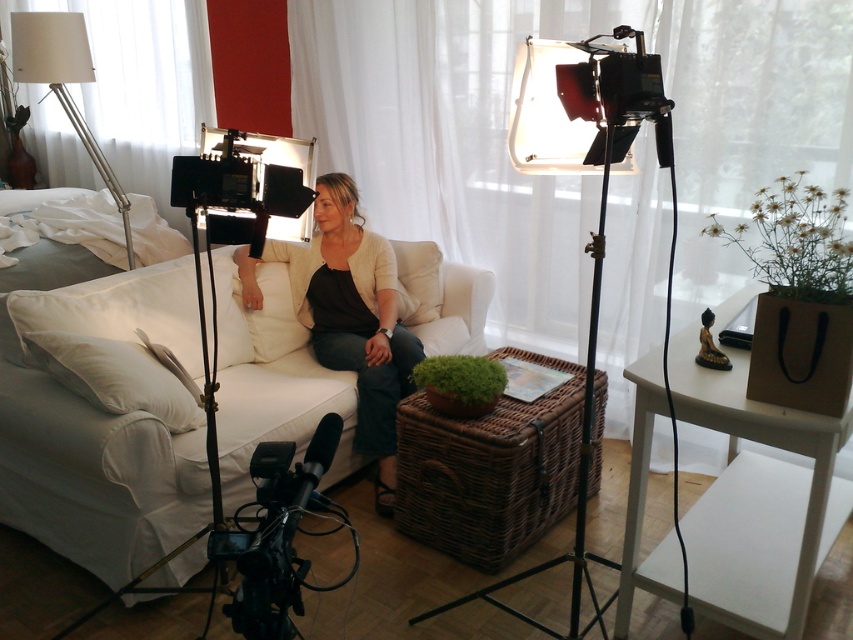
Looking at the scene, where is the white sheer curtain at upper center positioned relative to the white fabric couch at center?

The white sheer curtain at upper center is positioned to the right of the white fabric couch at center.

You are an interior designer planning to replace the white sheer curtain at upper center and the white fabric lampshade at upper left with new ones. If you want to maintain the current width proportions between them, which object should you choose to be wider when purchasing new items?

The white sheer curtain at upper center should be wider than the white fabric lampshade at upper left when purchasing new items to maintain the current width proportions between them.

You are a photographer setting up for a portrait session in this room. The camera is positioned to capture the woman on the white sofa. The white sheer curtain at upper center is part of the background. To ensure the curtain doesn not appear too large in the photo, what should you adjust?

The white sheer curtain at upper center is 2.43 meters from the camera. To prevent it from appearing too large in the photo, move the camera farther away from the curtain or use a wider lens to reduce its prominence in the frame.